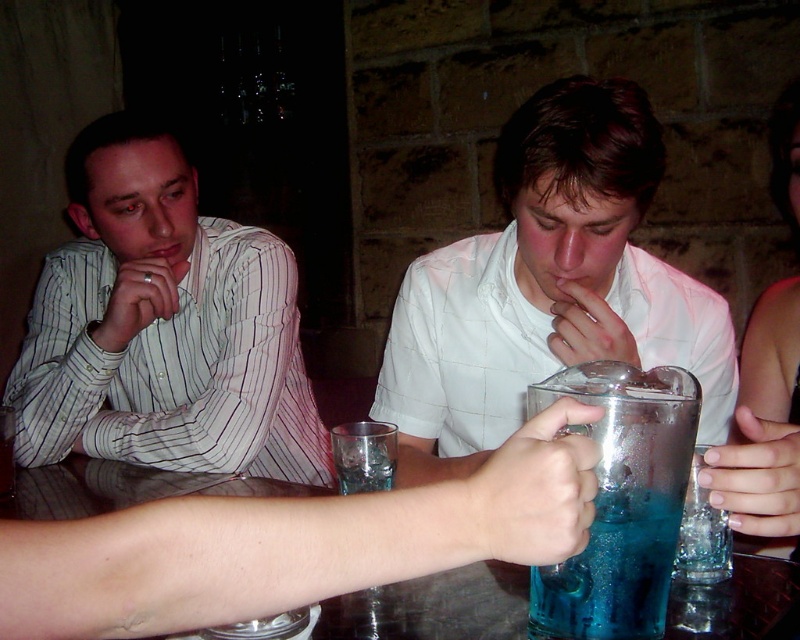
Question: Which object is farther from the camera taking this photo?

Choices:
 (A) white striped shirt at left
 (B) blue translucent liquid at center

Answer: (A)

Question: Is white striped shirt at left behind white matte shirt at center?

Choices:
 (A) no
 (B) yes

Answer: (B)

Question: Where is white striped shirt at left located in relation to clear glass at center in the image?

Choices:
 (A) above
 (B) below

Answer: (A)

Question: Which of these objects is positioned farthest from the white matte shirt at center?

Choices:
 (A) clear glass at center
 (B) blue translucent liquid at center

Answer: (B)

Question: Does white matte shirt at center appear on the right side of blue translucent liquid at center?

Choices:
 (A) yes
 (B) no

Answer: (A)

Question: Which point appears farthest from the camera in this image?

Choices:
 (A) (637, 461)
 (B) (412, 294)
 (C) (358, 438)
 (D) (94, 484)

Answer: (B)